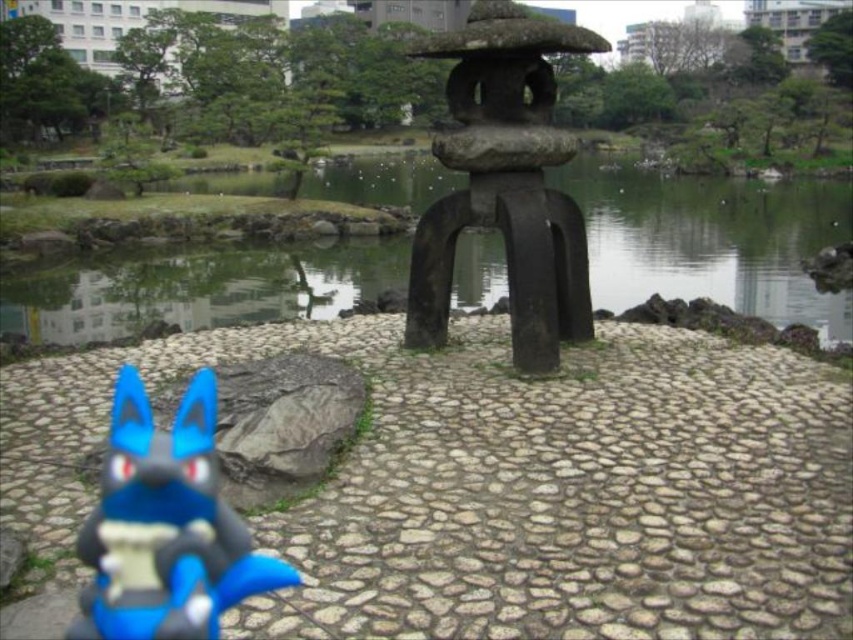
You are a visitor in the garden and want to place a small decoration between the green stone lake at center and the blue matte plush toy at lower left. Based on their positions, which object should you place the decoration closer to if you want it to be equidistant from both?

The decoration should be placed closer to the blue matte plush toy at lower left since the green stone lake at center is positioned to the right of the blue matte plush toy at lower left, meaning the distance between them requires the decoration to be nearer to the left side to maintain equal distance.

You are a visitor in the Japanese garden. You see the dark gray stone lantern at center and the blue matte plush toy at lower left. Which object is closer to you from your current viewpoint?

The dark gray stone lantern at center is positioned over the blue matte plush toy at lower left, meaning it is closer to you.

You are a photographer trying to capture the green stone lake at center and the blue matte plush toy at lower left in the same frame. Based on their heights, which object will appear taller in the photo?

The green stone lake at center will appear taller in the photo because it has a greater height compared to the blue matte plush toy at lower left.